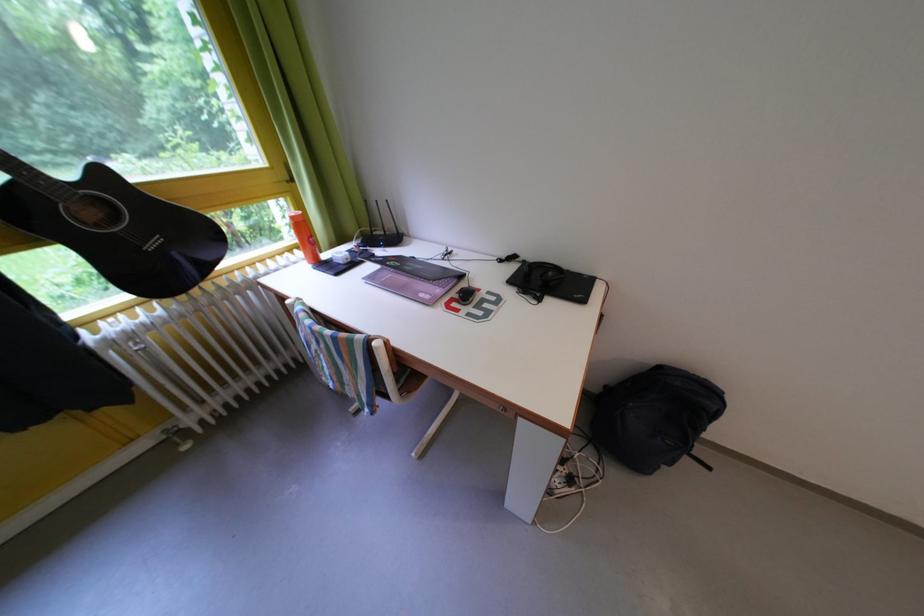
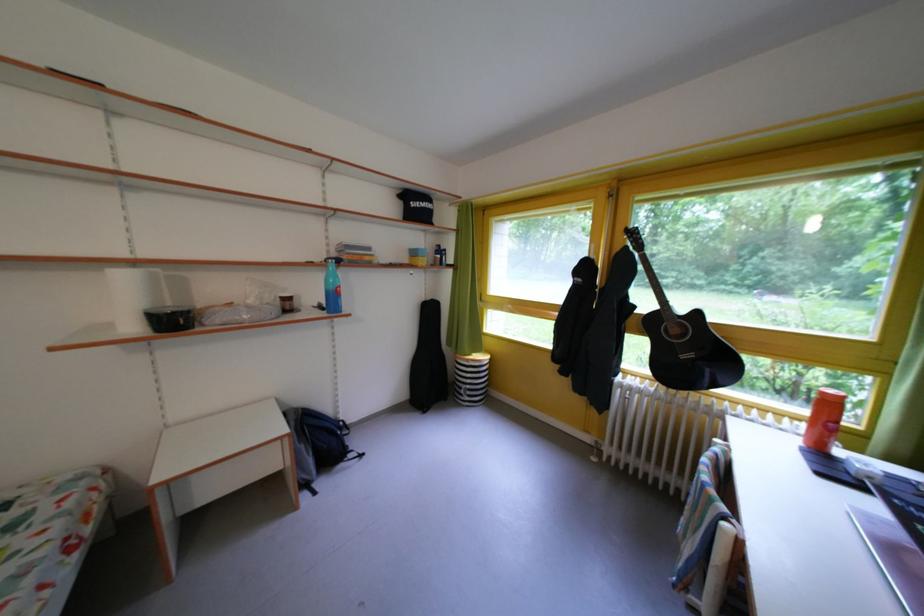
The point at (x=160, y=253) is marked in the first image. Where is the corresponding point in the second image?

(693, 362)